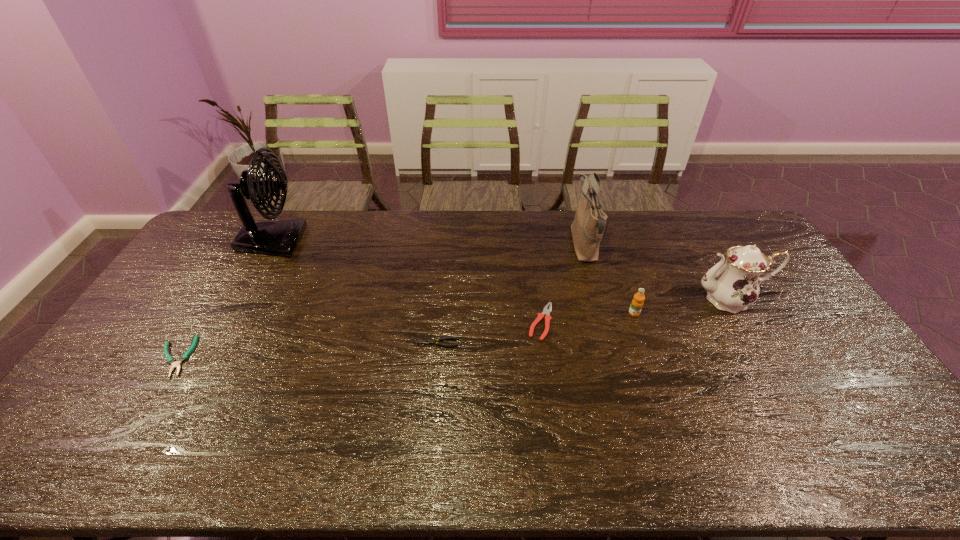
Where is `the tallest object`? the tallest object is located at coordinates (280, 237).

You are a GUI agent. You are given a task and a screenshot of the screen. Output one action in this format:
    pyautogui.click(x=<x>, y=<y>)
    Task: Click on the third object from right to left
    The width and height of the screenshot is (960, 540).
    Given the screenshot: What is the action you would take?
    pyautogui.click(x=587, y=228)

The width and height of the screenshot is (960, 540). I want to click on the second tallest object, so click(x=587, y=228).

Where is `chinaware`? chinaware is located at coordinates (731, 287).

The width and height of the screenshot is (960, 540). I want to click on the rightmost object, so click(731, 287).

Identify the location of orange juice. (637, 303).

Where is `the fourth tallest object`? This screenshot has width=960, height=540. the fourth tallest object is located at coordinates click(x=637, y=303).

Find the location of `the rightmost pliers`. the rightmost pliers is located at coordinates (546, 312).

Locate an element on the screen. This screenshot has width=960, height=540. the tallest pliers is located at coordinates (546, 312).

The height and width of the screenshot is (540, 960). In order to click on the third object from left to right in this screenshot , I will do `click(428, 341)`.